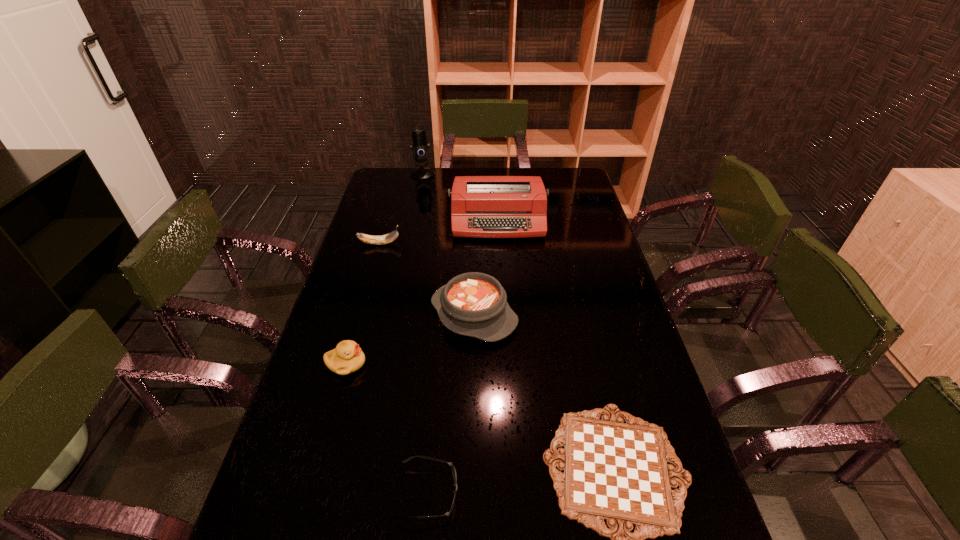
In the image, there is a desktop. What are the coordinates of `vacant space at the right edge` in the screenshot? It's located at (623, 289).

Find the location of a particular element. This screenshot has width=960, height=540. free space between the fifth farthest object and the fourth nearest object is located at coordinates (410, 339).

Find the location of a particular element. The image size is (960, 540). vacant area that lies between the farthest object and the fourth farthest object is located at coordinates (448, 245).

Find the location of a particular element. The height and width of the screenshot is (540, 960). empty location between the banana and the tallest object is located at coordinates (401, 209).

At what (x,y) coordinates should I click in order to perform the action: click on free space between the sixth tallest object and the farthest object. Please return your answer as a coordinate pair (x, y). Looking at the image, I should click on (425, 334).

What are the coordinates of `vacant area that lies between the sunglasses and the microphone` in the screenshot? It's located at (425, 334).

Locate an element on the screen. This screenshot has width=960, height=540. free spot between the duckling and the sixth shortest object is located at coordinates (422, 292).

You are a GUI agent. You are given a task and a screenshot of the screen. Output one action in this format:
    pyautogui.click(x=<x>, y=<y>)
    Task: Click on the free space between the fourth farthest object and the sixth tallest object
    
    Given the screenshot: What is the action you would take?
    pyautogui.click(x=451, y=404)

Locate which object ranks fifth in proximity to the banana. Please provide its 2D coordinates. Your answer should be formatted as a tuple, i.e. [(x, y)], where the tuple contains the x and y coordinates of a point satisfying the conditions above.

[(616, 471)]

Select which object appears as the fifth closest to the typewriter. Please provide its 2D coordinates. Your answer should be formatted as a tuple, i.e. [(x, y)], where the tuple contains the x and y coordinates of a point satisfying the conditions above.

[(616, 471)]